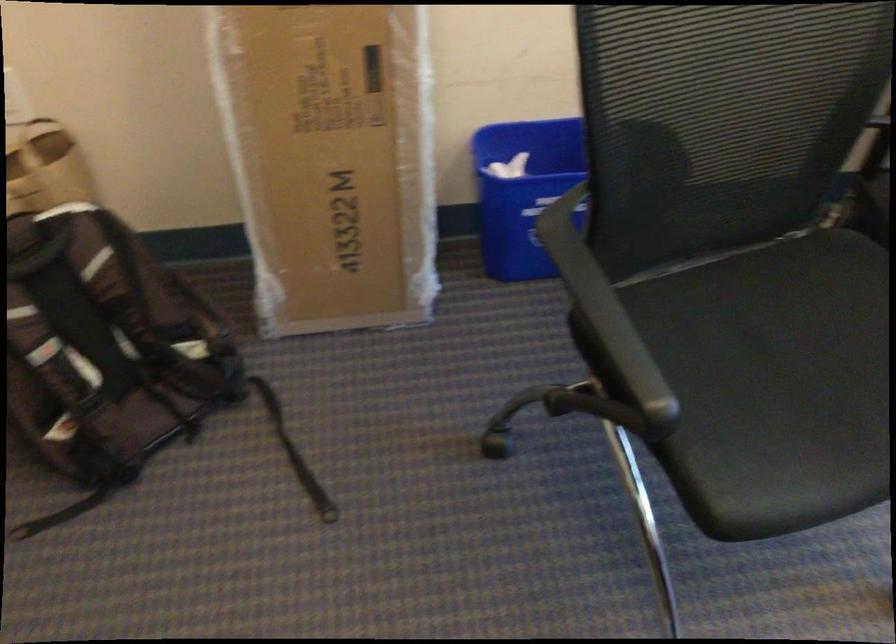
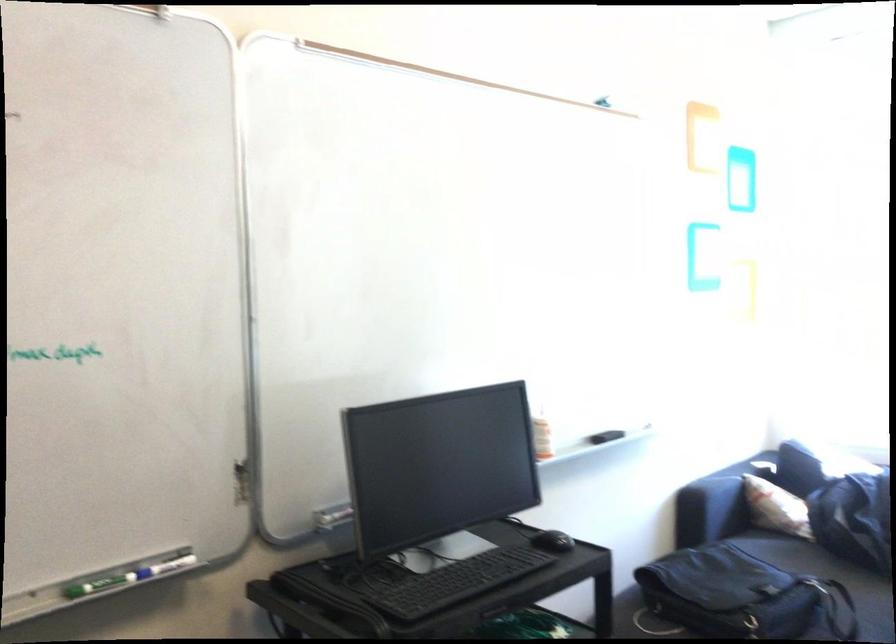
The images are taken continuously from a first-person perspective. In which direction is your viewpoint rotating?

The rotation direction of the camera is right-up.